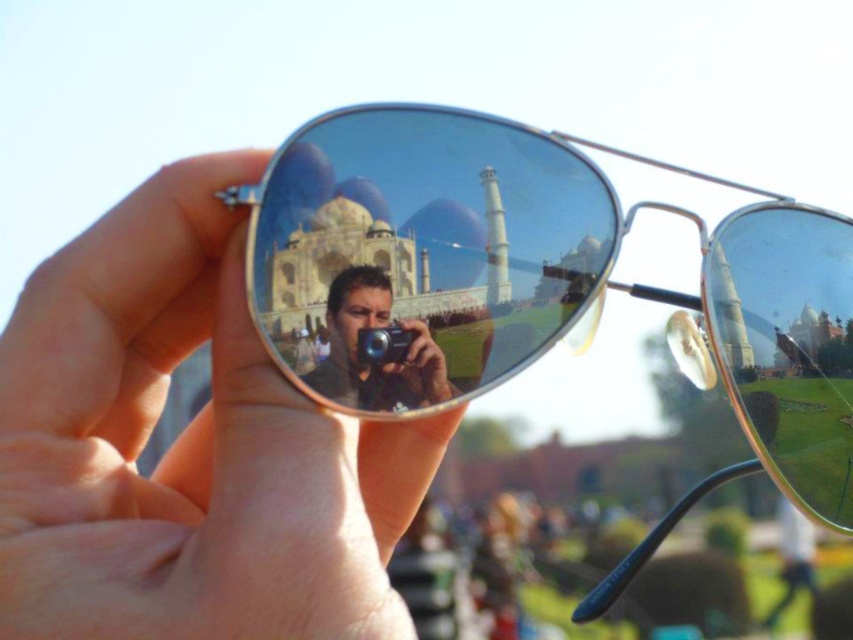
You are a photographer trying to capture the reflection of the Taj Mahal in the sunglasses. You notice a smooth skin hand at center and a matte black camera at center. Which object is positioned lower in the image?

The smooth skin hand at center is positioned lower than the matte black camera at center.

You are taking a photo of the Taj Mahal through the gold reflective sunglasses at center. Where exactly is the gold reflective sunglasses located in the image?

The gold reflective sunglasses at center is located at point (537, 285) in the image.

You are a photographer trying to capture the reflection of the Taj Mahal in the gold reflective sunglasses at center. To ensure the reflection is clear, you need to adjust your position so that the smooth skin hand at center does not block the view. Is the hand currently positioned in a way that might obstruct the reflection?

The smooth skin hand at center is closer to the viewer than the gold reflective sunglasses at center, so it may be blocking the reflection. Move the hand slightly to the side or adjust your angle to ensure the sunglasses are unobstructed.